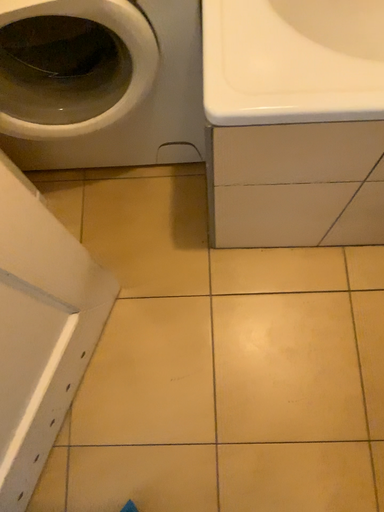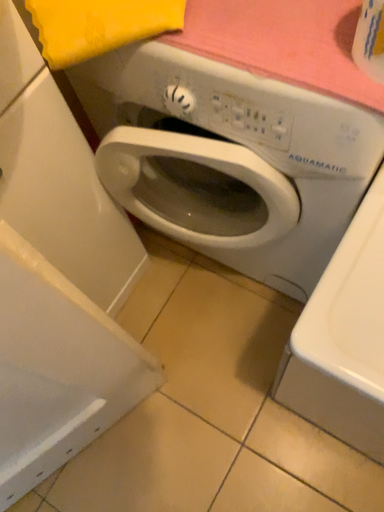
Question: How did the camera likely rotate when shooting the video?

Choices:
 (A) rotated right
 (B) rotated left

Answer: (B)